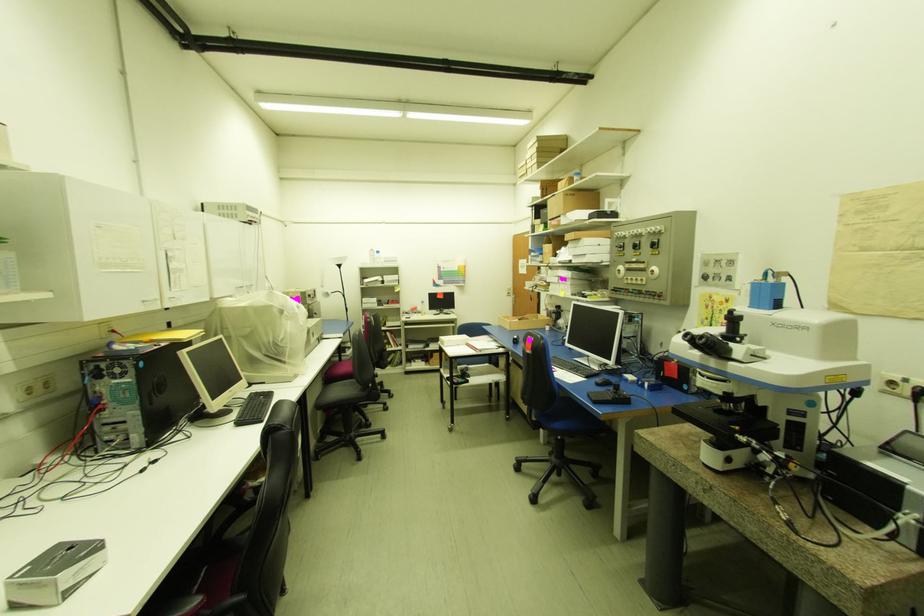
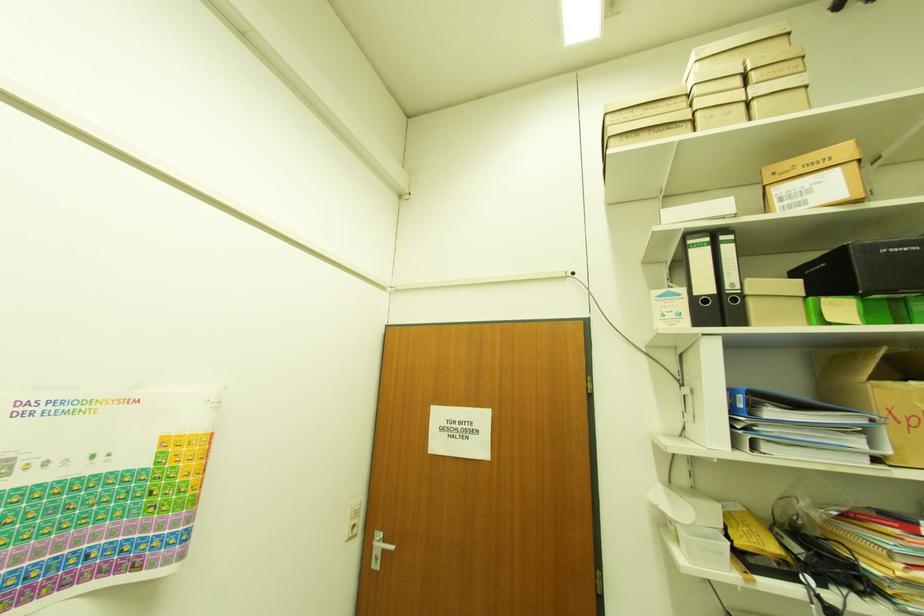
Where in the second image is the point corresponding to (x=512, y=294) from the first image?

(357, 528)